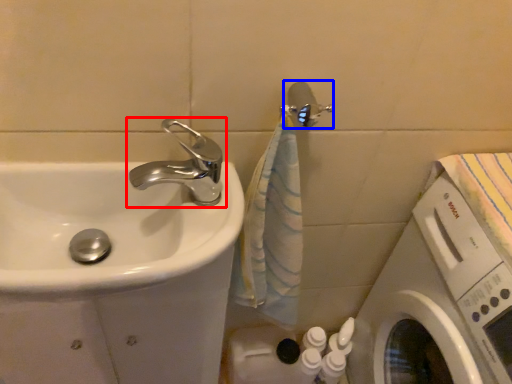
Question: Among these objects, which one is nearest to the camera, tap (highlighted by a red box) or shower (highlighted by a blue box)?

Choices:
 (A) tap
 (B) shower

Answer: (A)